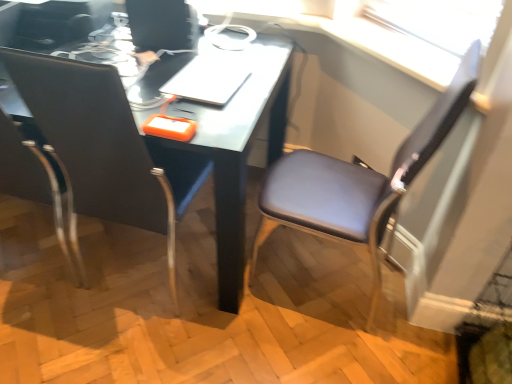
Image resolution: width=512 pixels, height=384 pixels. Describe the element at coordinates (358, 183) in the screenshot. I see `matte black chair at right, the 1th chair when ordered from right to left` at that location.

Identify the location of matte black chair at right, the second chair in the left-to-right sequence. The width and height of the screenshot is (512, 384). (358, 183).

Image resolution: width=512 pixels, height=384 pixels. Identify the location of black leather chair at left, the second chair viewed from the right. (106, 146).

What do you see at coordinates (106, 146) in the screenshot?
I see `black leather chair at left, the second chair viewed from the right` at bounding box center [106, 146].

Find the location of a particular element. The width and height of the screenshot is (512, 384). matte black chair at right, the 1th chair when ordered from right to left is located at coordinates (358, 183).

Based on the photo, in the image, is black leather chair at left, the second chair viewed from the right, on the left side or the right side of matte black chair at right, the 1th chair when ordered from right to left?

black leather chair at left, the second chair viewed from the right, is positioned on matte black chair at right, the 1th chair when ordered from right to left,'s left side.

Which object is further away from the camera, black leather chair at left, placed as the 1th chair when sorted from left to right, or matte black chair at right, the 1th chair when ordered from right to left?

matte black chair at right, the 1th chair when ordered from right to left, is behind.

Does point (69, 84) lie in front of point (292, 171)?

Yes, it is.

From the image's perspective, which one is positioned lower, black leather chair at left, the second chair viewed from the right, or matte black chair at right, the 1th chair when ordered from right to left?

matte black chair at right, the 1th chair when ordered from right to left, from the image's perspective.

In the scene shown: From a real-world perspective, is black leather chair at left, the second chair viewed from the right, above or below matte black chair at right, the 1th chair when ordered from right to left?

black leather chair at left, the second chair viewed from the right, is above matte black chair at right, the 1th chair when ordered from right to left.

Considering the sizes of objects black leather chair at left, the second chair viewed from the right, and matte black chair at right, the 1th chair when ordered from right to left, in the image provided, who is thinner, black leather chair at left, the second chair viewed from the right, or matte black chair at right, the 1th chair when ordered from right to left,?

matte black chair at right, the 1th chair when ordered from right to left, is thinner.

Who is taller, black leather chair at left, the second chair viewed from the right, or matte black chair at right, the second chair in the left-to-right sequence?

With more height is matte black chair at right, the second chair in the left-to-right sequence.

Who is bigger, black leather chair at left, placed as the 1th chair when sorted from left to right, or matte black chair at right, the second chair in the left-to-right sequence?

black leather chair at left, placed as the 1th chair when sorted from left to right, is bigger.

Is black leather chair at left, placed as the 1th chair when sorted from left to right, not within matte black chair at right, the 1th chair when ordered from right to left?

black leather chair at left, placed as the 1th chair when sorted from left to right, is positioned outside matte black chair at right, the 1th chair when ordered from right to left.

Are black leather chair at left, the second chair viewed from the right, and matte black chair at right, the second chair in the left-to-right sequence, far apart?

No, black leather chair at left, the second chair viewed from the right, is not far from matte black chair at right, the second chair in the left-to-right sequence.

Could you tell me if black leather chair at left, placed as the 1th chair when sorted from left to right, is facing matte black chair at right, the second chair in the left-to-right sequence?

No.

How different are the orientations of black leather chair at left, the second chair viewed from the right, and matte black chair at right, the second chair in the left-to-right sequence, in degrees?

83.7 degrees.

Could you measure the distance between black leather chair at left, placed as the 1th chair when sorted from left to right, and matte black chair at right, the 1th chair when ordered from right to left?

black leather chair at left, placed as the 1th chair when sorted from left to right, and matte black chair at right, the 1th chair when ordered from right to left, are 56.56 centimeters apart from each other.

Locate an element on the screen. This screenshot has height=384, width=512. chair that is in front of the matte black chair at right, the 1th chair when ordered from right to left is located at coordinates (106, 146).

Can you confirm if matte black chair at right, the 1th chair when ordered from right to left, is positioned to the right of black leather chair at left, placed as the 1th chair when sorted from left to right?

Yes.

Who is more distant, matte black chair at right, the 1th chair when ordered from right to left, or black leather chair at left, placed as the 1th chair when sorted from left to right?

matte black chair at right, the 1th chair when ordered from right to left.

Considering the points (348, 213) and (46, 91), which point is in front, point (348, 213) or point (46, 91)?

The point (46, 91) is more forward.

From the image's perspective, which object appears higher, matte black chair at right, the 1th chair when ordered from right to left, or black leather chair at left, the second chair viewed from the right?

black leather chair at left, the second chair viewed from the right, from the image's perspective.

From a real-world perspective, does matte black chair at right, the 1th chair when ordered from right to left, sit lower than black leather chair at left, the second chair viewed from the right?

Yes, from a real-world perspective, matte black chair at right, the 1th chair when ordered from right to left, is beneath black leather chair at left, the second chair viewed from the right.

Between matte black chair at right, the second chair in the left-to-right sequence, and black leather chair at left, placed as the 1th chair when sorted from left to right, which one has smaller width?

matte black chair at right, the second chair in the left-to-right sequence, is thinner.

Which of these two, matte black chair at right, the second chair in the left-to-right sequence, or black leather chair at left, the second chair viewed from the right, stands shorter?

With less height is black leather chair at left, the second chair viewed from the right.

Considering the sizes of objects matte black chair at right, the 1th chair when ordered from right to left, and black leather chair at left, placed as the 1th chair when sorted from left to right, in the image provided, who is bigger, matte black chair at right, the 1th chair when ordered from right to left, or black leather chair at left, placed as the 1th chair when sorted from left to right,?

Bigger between the two is black leather chair at left, placed as the 1th chair when sorted from left to right.

Choose the correct answer: Is matte black chair at right, the 1th chair when ordered from right to left, inside black leather chair at left, the second chair viewed from the right, or outside it?

matte black chair at right, the 1th chair when ordered from right to left, is located beyond the bounds of black leather chair at left, the second chair viewed from the right.

Are matte black chair at right, the second chair in the left-to-right sequence, and black leather chair at left, the second chair viewed from the right, making contact?

Answer: matte black chair at right, the second chair in the left-to-right sequence, and black leather chair at left, the second chair viewed from the right, are clearly separated.

From the picture: Is matte black chair at right, the 1th chair when ordered from right to left, turned away from black leather chair at left, placed as the 1th chair when sorted from left to right?

No, matte black chair at right, the 1th chair when ordered from right to left, is not facing the opposite direction of black leather chair at left, placed as the 1th chair when sorted from left to right.

At what (x,y) coordinates should I click in order to perform the action: click on chair lying behind the black leather chair at left, placed as the 1th chair when sorted from left to right. Please return your answer as a coordinate pair (x, y). Looking at the image, I should click on (358, 183).

Locate an element on the screen. This screenshot has height=384, width=512. chair that appears below the black leather chair at left, placed as the 1th chair when sorted from left to right (from a real-world perspective) is located at coordinates (358, 183).

Locate an element on the screen. chair above the matte black chair at right, the 1th chair when ordered from right to left (from a real-world perspective) is located at coordinates (106, 146).